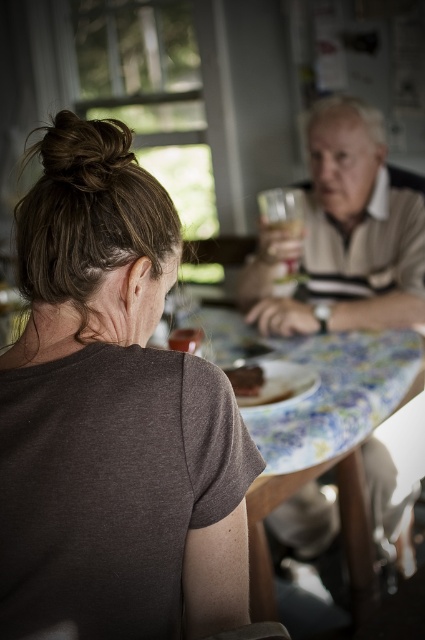
Measure the distance from dark gray t-shirt at left to smooth brown bread at center.

dark gray t-shirt at left is 25.78 inches away from smooth brown bread at center.

Between dark gray t-shirt at left and smooth brown bread at center, which one has less height?

smooth brown bread at center is shorter.

Is point (178, 225) closer to camera compared to point (238, 376)?

Yes, point (178, 225) is in front of point (238, 376).

Locate an element on the screen. The height and width of the screenshot is (640, 425). dark gray t-shirt at left is located at coordinates (105, 404).

Can you confirm if dark gray t-shirt at left is taller than floral-patterned table at center?

Incorrect, dark gray t-shirt at left's height is not larger of floral-patterned table at center's.

Is the position of dark gray t-shirt at left more distant than that of floral-patterned table at center?

That is False.

Is point (70, 481) farther from viewer compared to point (354, 358)?

That is False.

The height and width of the screenshot is (640, 425). Find the location of `dark gray t-shirt at left`. dark gray t-shirt at left is located at coordinates (105, 404).

Describe the element at coordinates (328, 442) in the screenshot. This screenshot has height=640, width=425. I see `floral-patterned table at center` at that location.

Is point (331, 451) positioned after point (291, 212)?

No, (331, 451) is closer to viewer.

Where is `floral-patterned table at center`? This screenshot has height=640, width=425. floral-patterned table at center is located at coordinates (328, 442).